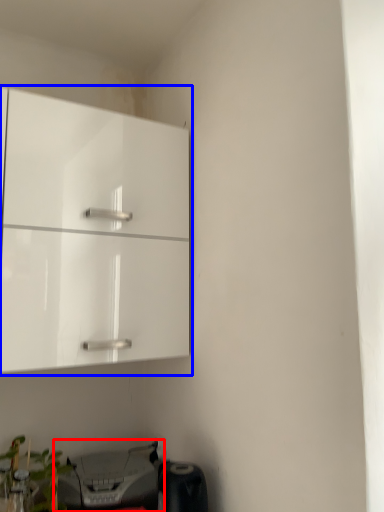
Question: Which object is further to the camera taking this photo, printer (highlighted by a red box) or cabinetry (highlighted by a blue box)?

Choices:
 (A) printer
 (B) cabinetry

Answer: (A)